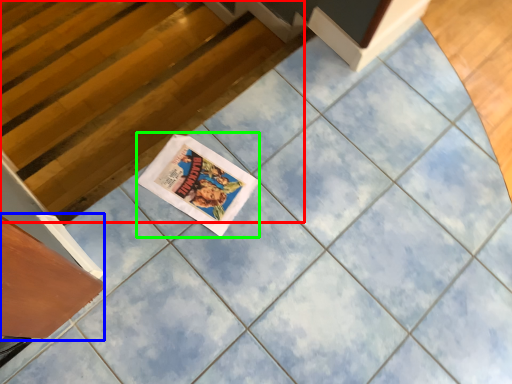
Question: Which object is the closest to the stairwell (highlighted by a red box)? Choose among these: drawer (highlighted by a blue box) or comic book (highlighted by a green box).

Choices:
 (A) drawer
 (B) comic book

Answer: (B)